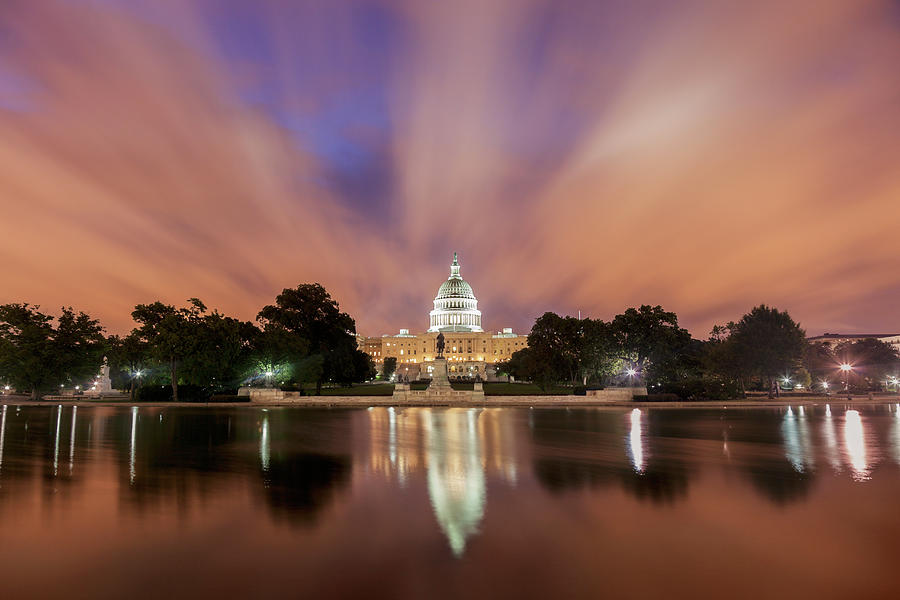
I want to click on light, so click(x=844, y=364).